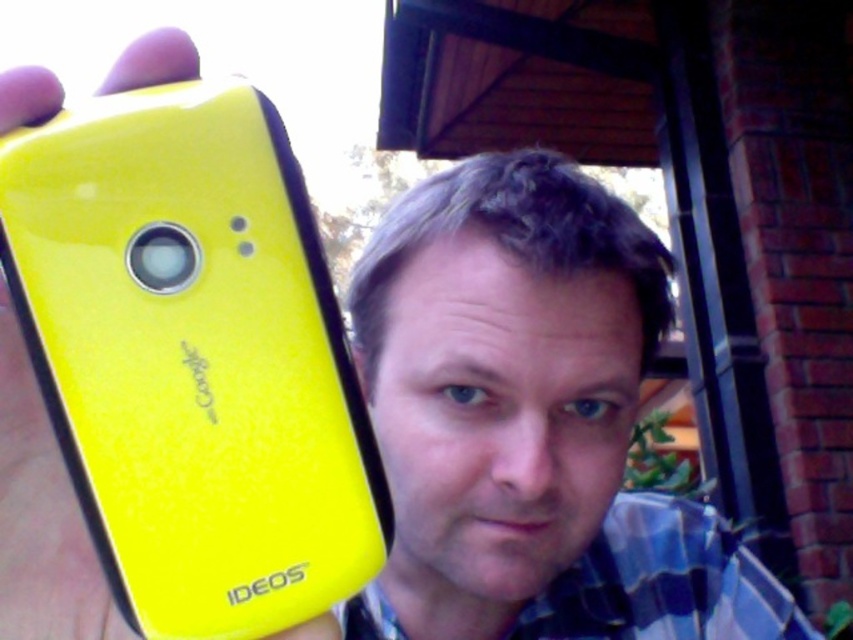
You are a photographer trying to capture both the yellow matte phone at left and the matte yellow phone at upper left in a single frame. Given that your camera has a maximum focus range of 10 inches, will you be able to focus on both objects simultaneously?

The yellow matte phone at left and the matte yellow phone at upper left are 11.01 inches apart, which exceeds the camera maximum focus range of 10 inches. Therefore, you cannot focus on both objects simultaneously.

From the picture: You are taking a photo of two matte yellow phones displayed on a table. The yellow matte phone at left and the matte yellow phone at upper left are both present. Which phone is positioned more to the left?

The yellow matte phone at left is positioned more to the left than the matte yellow phone at upper left.